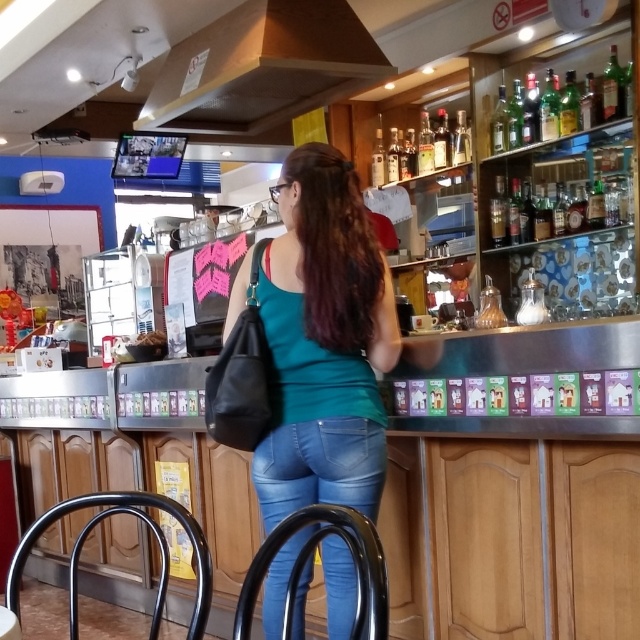
Question: In this image, where is teal matte tank top at center located relative to jeans at center?

Choices:
 (A) above
 (B) below

Answer: (A)

Question: Among these points, which one is farthest from the camera?

Choices:
 (A) (545, 218)
 (B) (316, 493)
 (C) (278, 394)

Answer: (A)

Question: Which object is the closest to the jeans at center?

Choices:
 (A) teal matte tank top at center
 (B) translucent glass bottles at upper right

Answer: (A)

Question: Does teal matte tank top at center appear over jeans at center?

Choices:
 (A) no
 (B) yes

Answer: (B)

Question: Is teal matte tank top at center to the left of translucent glass bottles at upper right from the viewer's perspective?

Choices:
 (A) yes
 (B) no

Answer: (A)

Question: Which point is closer to the camera?

Choices:
 (A) (333, 605)
 (B) (284, 477)
 (C) (596, 205)

Answer: (A)